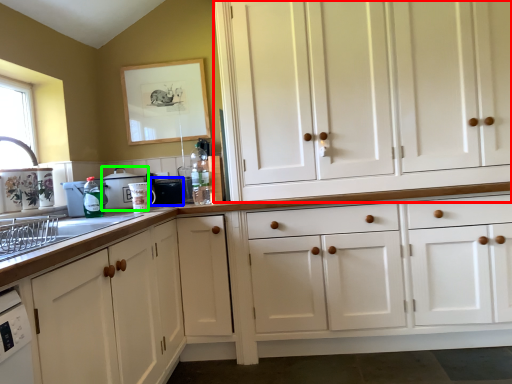
Question: Estimate the real-world distances between objects in this image. Which object is farther from cabinetry (highlighted by a red box), appliance (highlighted by a blue box) or appliance (highlighted by a green box)?

Choices:
 (A) appliance
 (B) appliance

Answer: (B)